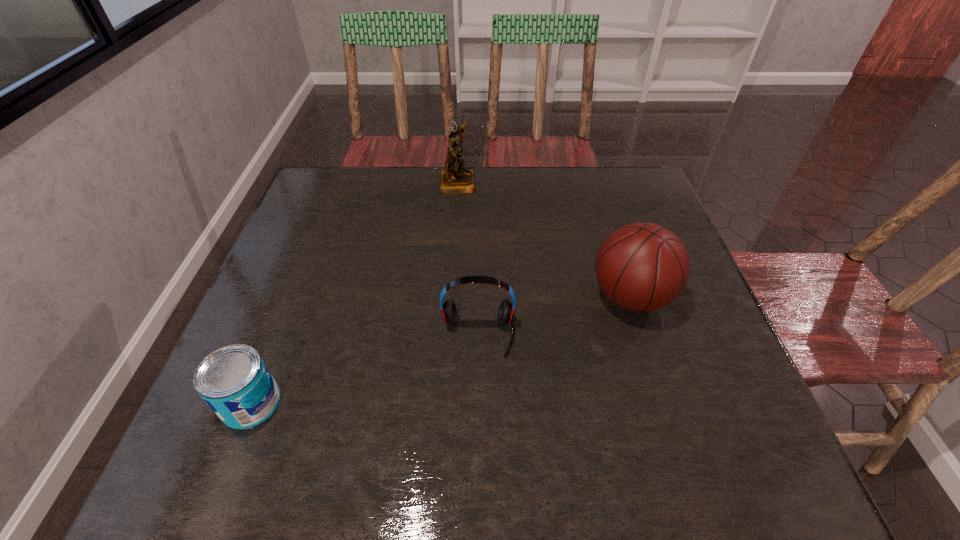
At what (x,y) coordinates should I click in order to perform the action: click on figurine. Please return your answer as a coordinate pair (x, y). Looking at the image, I should click on (455, 179).

Identify the location of basketball. (643, 267).

You are a GUI agent. You are given a task and a screenshot of the screen. Output one action in this format:
    pyautogui.click(x=<x>, y=<y>)
    Task: Click on the headset
    Image resolution: width=960 pixels, height=540 pixels.
    Given the screenshot: What is the action you would take?
    pyautogui.click(x=506, y=310)

Identify the location of the nearest object. (234, 381).

Locate an element on the screen. This screenshot has width=960, height=540. can is located at coordinates (234, 381).

Identify the location of vacant region located on the front-facing side of the figurine. (588, 182).

You are a GUI agent. You are given a task and a screenshot of the screen. Output one action in this format:
    pyautogui.click(x=<x>, y=<y>)
    Task: Click on the vacant region located 0.070m on the front of the basketball
    Image resolution: width=960 pixels, height=540 pixels.
    Given the screenshot: What is the action you would take?
    pyautogui.click(x=650, y=357)

The width and height of the screenshot is (960, 540). Find the location of `vacant space positioned with the microphone attached to the side of the headset`. vacant space positioned with the microphone attached to the side of the headset is located at coordinates (477, 449).

I want to click on vacant space located on the back of the leftmost object, so click(313, 245).

Find the location of `object that is at the far edge`. object that is at the far edge is located at coordinates (455, 179).